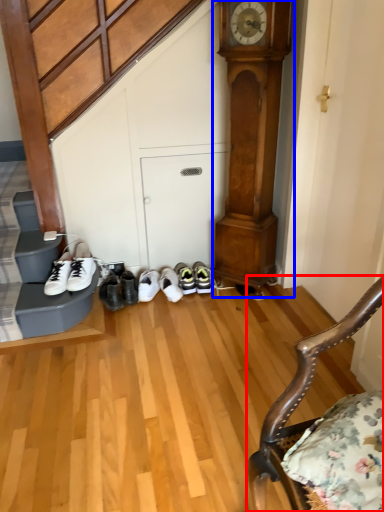
Question: Which object appears farthest to the camera in this image, chair (highlighted by a red box) or clock (highlighted by a blue box)?

Choices:
 (A) chair
 (B) clock

Answer: (B)